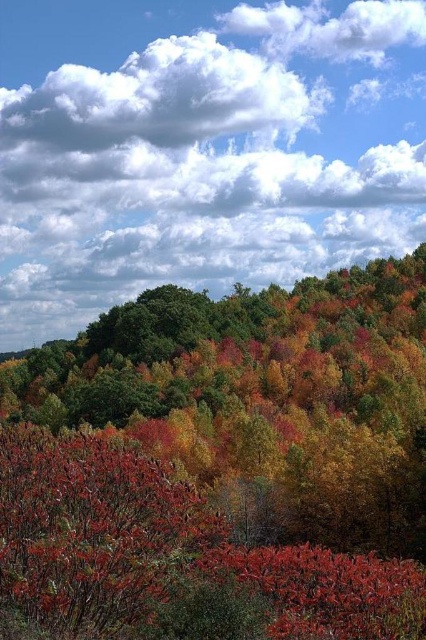
Based on the scene description, where is the autumn foliage at center relative to the white fluffy cloud at upper center?

The autumn foliage at center is to the right of the white fluffy cloud at upper center.

You are an artist painting the autumn landscape. You want to ensure the autumn foliage at center and the white fluffy cloud at upper center are proportionally accurate. Which object should you paint to be larger?

The white fluffy cloud at upper center should be painted larger since it is bigger than the autumn foliage at center according to the description.

You are an artist trying to paint the autumn scene. You want to ensure the autumn foliage at center and white fluffy cloud at upper center are proportionate. Which object should you paint smaller in your artwork?

The autumn foliage at center should be painted smaller than the white fluffy cloud at upper center because the autumn foliage at center is shorter than the white fluffy cloud at upper center in the scene.